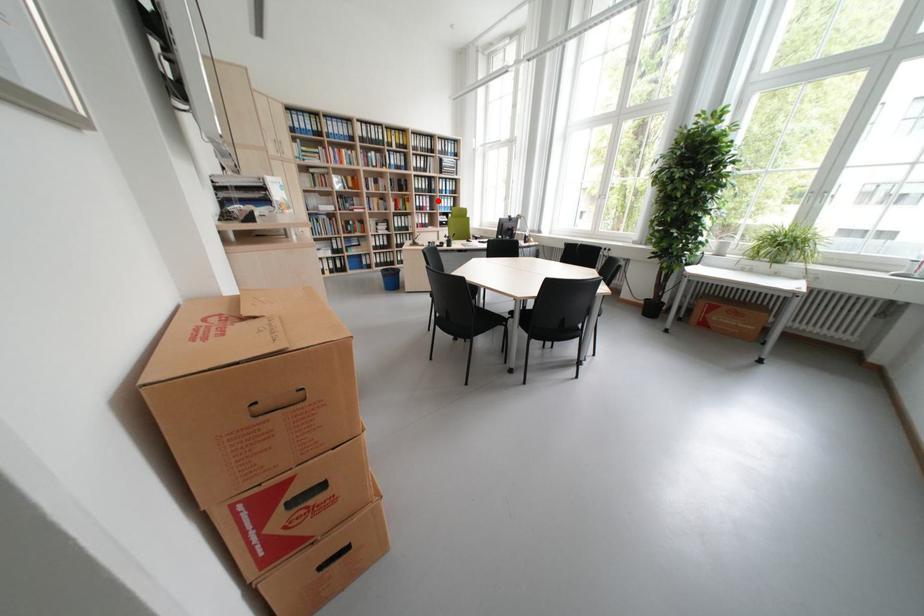
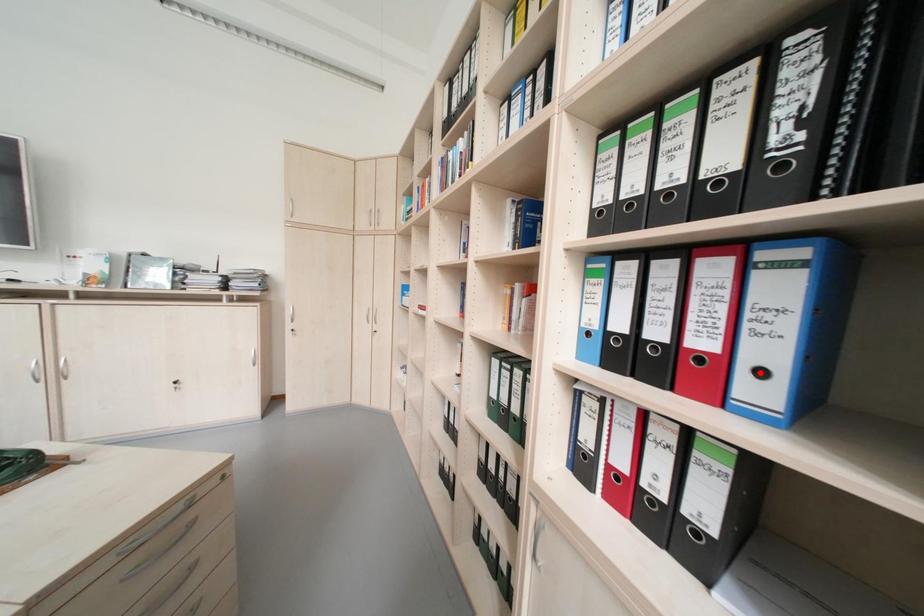
I am providing you with two images of the same scene from different viewpoints. A red point is marked on the first image and another point is marked on the second image. Do the highlighted points in image1 and image2 indicate the same real-world spot?

No